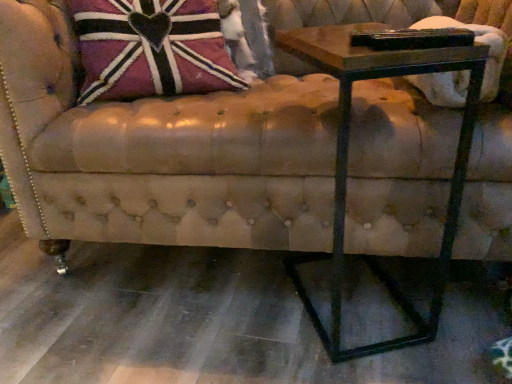
Question: Considering the positions of point coord(460,54) and point coord(190,238), is point coord(460,54) closer or farther from the camera than point coord(190,238)?

Choices:
 (A) closer
 (B) farther

Answer: (A)

Question: Would you say wooden table at right is to the left or to the right of leather couch at center in the picture?

Choices:
 (A) left
 (B) right

Answer: (B)

Question: Which object is the farthest from the leather-like union jack pillow at upper left?

Choices:
 (A) leather couch at center
 (B) wooden table at right

Answer: (B)

Question: Which is farther from the leather couch at center?

Choices:
 (A) wooden table at right
 (B) leather-like union jack pillow at upper left

Answer: (B)